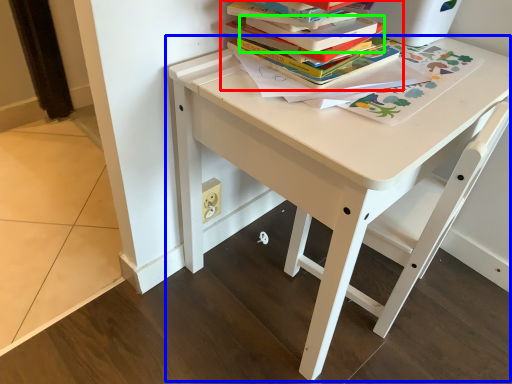
Question: Considering the real-world distances, which object is farthest from book (highlighted by a red box)? table (highlighted by a blue box) or paperback book (highlighted by a green box)?

Choices:
 (A) table
 (B) paperback book

Answer: (A)